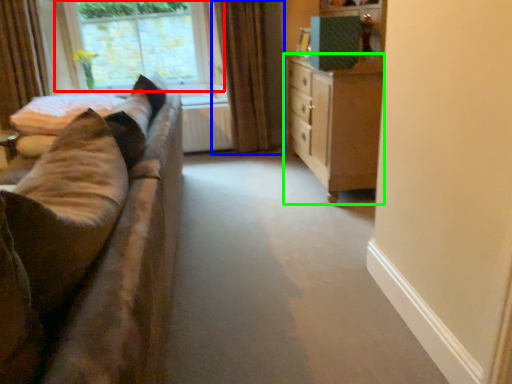
Question: Which object is the farthest from window (highlighted by a red box)? Choose among these: curtain (highlighted by a blue box) or chest of drawers (highlighted by a green box).

Choices:
 (A) curtain
 (B) chest of drawers

Answer: (B)